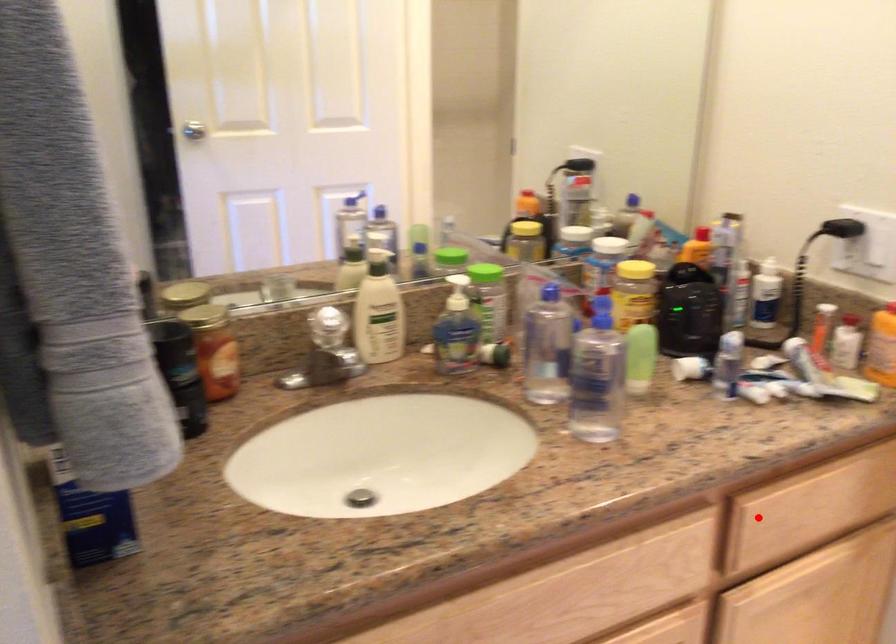
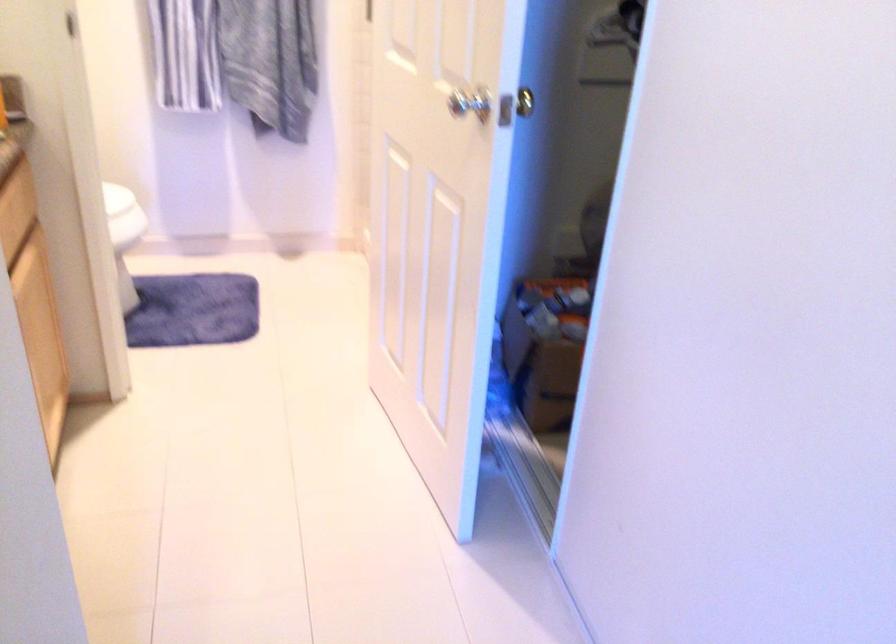
Question: I am providing you with two images of the same scene from different viewpoints. A red point is marked on the first image. Can you still see the location of the red point in image 2?

Choices:
 (A) Yes
 (B) No

Answer: (A)